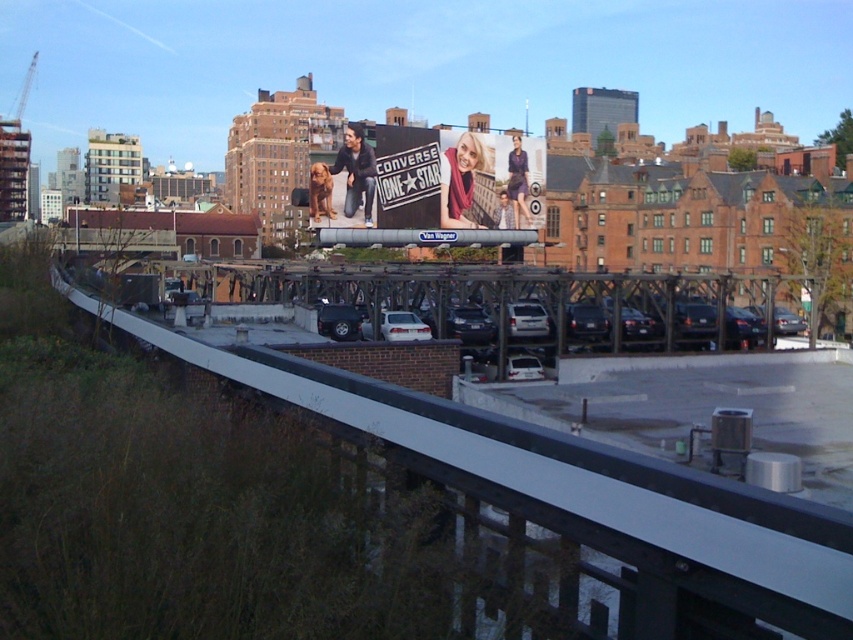
You are standing on the rooftop and want to take a photo of the matte white billboard at center without any obstructions. Is the white smooth train track at center blocking your view of the billboard?

The white smooth train track at center is located below the matte white billboard at center, so it won not block your view of the billboard.

Where is the metallic gray overpass at center located in the image?

The metallic gray overpass at center is located at point coordinates of (517, 298).